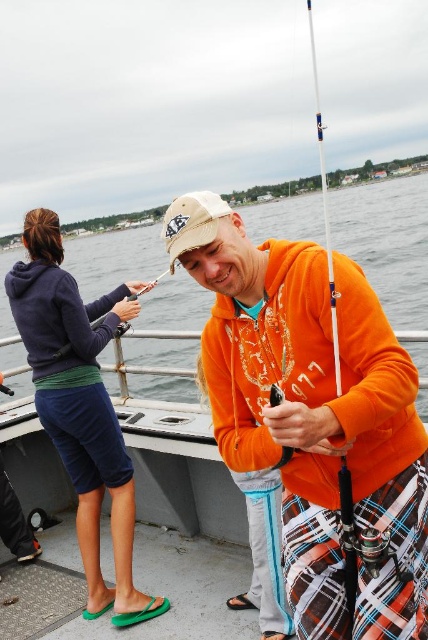
Question: Considering the relative positions of orange fleece at center and khaki fabric baseball cap at center in the image provided, where is orange fleece at center located with respect to khaki fabric baseball cap at center?

Choices:
 (A) above
 (B) below

Answer: (B)

Question: Is matte orange hoodie at center positioned behind khaki fabric baseball cap at center?

Choices:
 (A) yes
 (B) no

Answer: (A)

Question: Which object appears farthest from the camera in this image?

Choices:
 (A) white plastic fishing pole at right
 (B) matte purple hoodie at left

Answer: (B)

Question: Among these points, which one is farthest from the camera?

Choices:
 (A) (413, 544)
 (B) (151, 604)
 (C) (184, 195)

Answer: (B)

Question: Is matte orange hoodie at center further to the viewer compared to matte purple hoodie at left?

Choices:
 (A) no
 (B) yes

Answer: (B)

Question: Based on their relative distances, which object is nearer to the khaki fabric baseball cap at center?

Choices:
 (A) orange fleece at center
 (B) matte purple hoodie at left
 (C) matte orange hoodie at center

Answer: (A)